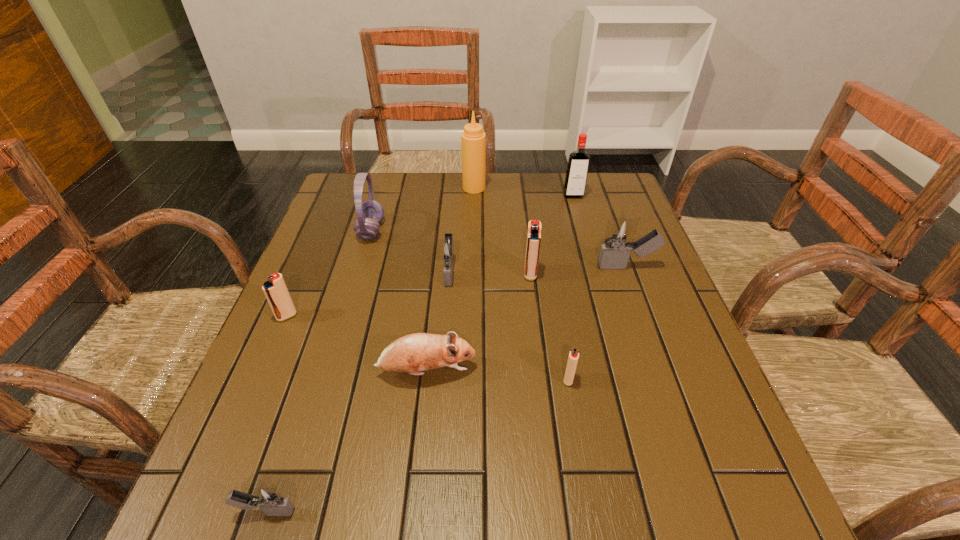
At what (x,y) coordinates should I click in order to perform the action: click on free space located on the front of the biggest red igniter. Please return your answer as a coordinate pair (x, y). Looking at the image, I should click on (546, 403).

This screenshot has width=960, height=540. Find the location of `free space located on the front of the rightmost gray igniter`. free space located on the front of the rightmost gray igniter is located at coordinates (675, 401).

Find the location of a particular element. free location located on the back of the fourth igniter from right to left is located at coordinates tap(455, 197).

The width and height of the screenshot is (960, 540). Find the location of `free point located on the back of the leftmost igniter`. free point located on the back of the leftmost igniter is located at coordinates (320, 239).

You are a GUI agent. You are given a task and a screenshot of the screen. Output one action in this format:
    pyautogui.click(x=<x>, y=<y>)
    Task: Click on the free spot located at the face of the hamster
    The width and height of the screenshot is (960, 540).
    Given the screenshot: What is the action you would take?
    pyautogui.click(x=571, y=372)

Locate an element on the screen. The width and height of the screenshot is (960, 540). vacant space located 0.370m on the back of the nearest red igniter is located at coordinates (546, 253).

Identify the location of vacant region located on the left of the smallest gray igniter. The width and height of the screenshot is (960, 540). (193, 511).

Where is `condiment that is at the far edge`? Image resolution: width=960 pixels, height=540 pixels. condiment that is at the far edge is located at coordinates (473, 139).

Image resolution: width=960 pixels, height=540 pixels. I want to click on vodka located at the far edge, so click(x=578, y=162).

Identify the location of headset located at the far edge. This screenshot has height=540, width=960. (369, 213).